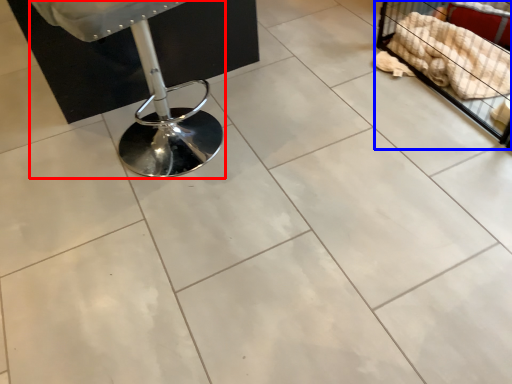
Question: Among these objects, which one is nearest to the camera, swivel chair (highlighted by a red box) or furniture (highlighted by a blue box)?

Choices:
 (A) swivel chair
 (B) furniture

Answer: (A)